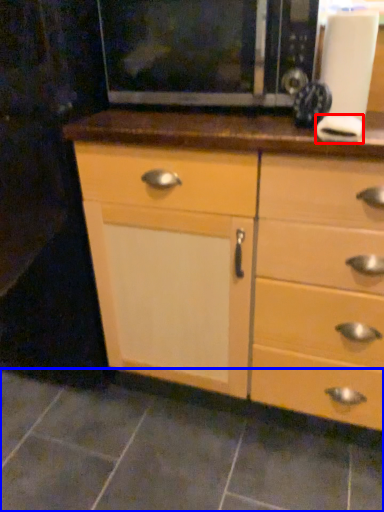
Question: Which object appears farthest to the camera in this image, knob (highlighted by a red box) or tile (highlighted by a blue box)?

Choices:
 (A) knob
 (B) tile

Answer: (B)